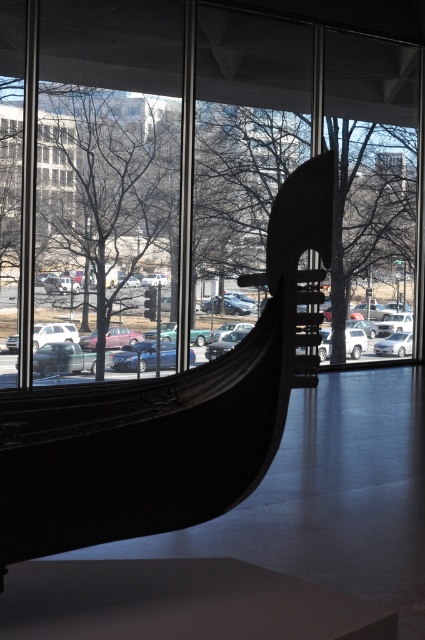
Can you confirm if transparent glass window at center is wider than white glossy car at center?

Yes.

Can you confirm if transparent glass window at center is positioned below white glossy car at center?

No, transparent glass window at center is not below white glossy car at center.

Which is in front, point (356, 273) or point (393, 333)?

Point (393, 333)

The image size is (425, 640). I want to click on transparent glass window at center, so click(x=193, y=161).

Can you confirm if transparent glass window at center is positioned below metallic silver car at center?

Actually, transparent glass window at center is above metallic silver car at center.

Is transparent glass window at center closer to the viewer compared to metallic silver car at center?

Yes, it is in front of metallic silver car at center.

What do you see at coordinates (193, 161) in the screenshot?
I see `transparent glass window at center` at bounding box center [193, 161].

Find the location of `transparent glass window at center`. transparent glass window at center is located at coordinates (193, 161).

Is shiny blue sedan at center shorter than white matte car at left?

No, shiny blue sedan at center is not shorter than white matte car at left.

Does point (127, 355) come in front of point (76, 337)?

That is False.

This screenshot has height=640, width=425. Identify the location of shiny blue sedan at center. (x=136, y=356).